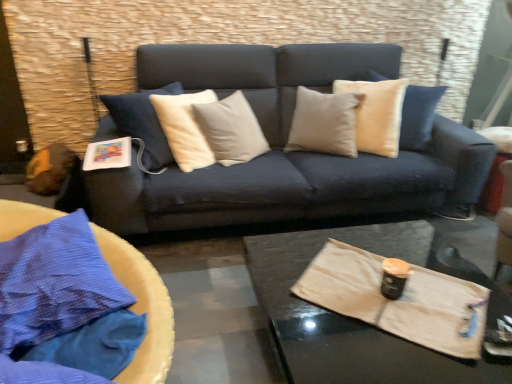
Question: Relative to black matte can at center, is wooden tray at center in front or behind?

Choices:
 (A) front
 (B) behind

Answer: (A)

Question: Choose the correct answer: Is wooden tray at center inside black matte can at center or outside it?

Choices:
 (A) inside
 (B) outside

Answer: (B)

Question: Which object is positioned farthest from the wooden tray at center?

Choices:
 (A) blue fabric at left
 (B) black matte can at center

Answer: (A)

Question: Estimate the real-world distances between objects in this image. Which object is closer to the blue fabric at left?

Choices:
 (A) wooden tray at center
 (B) black matte can at center

Answer: (A)